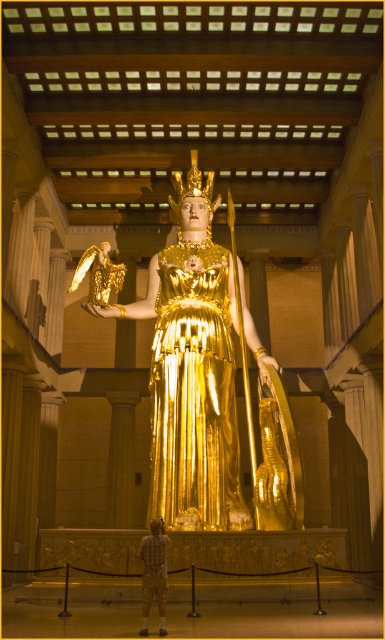
Question: In this image, where is gold reflective statue at center located relative to gold metallic dress at center?

Choices:
 (A) below
 (B) above

Answer: (B)

Question: Which object appears farthest from the camera in this image?

Choices:
 (A) gold reflective statue at center
 (B) plaid shirt at center
 (C) gold metallic dress at center

Answer: (C)

Question: Which object is farther from the camera taking this photo?

Choices:
 (A) plaid shirt at center
 (B) gold reflective statue at center

Answer: (B)

Question: Is gold reflective statue at center further to camera compared to gold metallic dress at center?

Choices:
 (A) yes
 (B) no

Answer: (B)

Question: Considering the relative positions of gold reflective statue at center and plaid shirt at center in the image provided, where is gold reflective statue at center located with respect to plaid shirt at center?

Choices:
 (A) right
 (B) left

Answer: (A)

Question: Which point is farther to the camera?

Choices:
 (A) (143, 572)
 (B) (177, 365)
 (C) (199, 227)

Answer: (C)